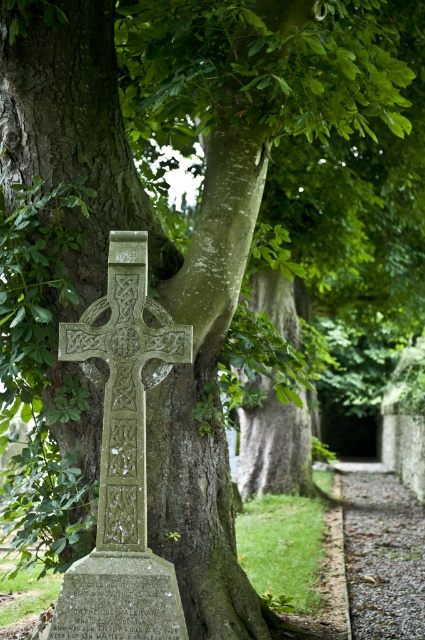
You are a gardener planning to place a new decorative stone that is 1 foot wide on the gravel path at lower center and the granite gravestone at center. Which location can accommodate the stone without needing adjustments?

The granite gravestone at center is wider than the gravel path at lower center, so placing the 1 foot wide stone on the granite gravestone at center would be possible without adjustments. The gravel path at lower center is narrower and might not fit the stone properly.

You are a landscape architect designing a memorial garden. You need to ensure that the green stone cross at center and the granite gravestone at center are visible from a central viewing path. Given their heights, which object will appear taller when viewed from the path?

The green stone cross at center appears taller than the granite gravestone at center because it has a greater height.